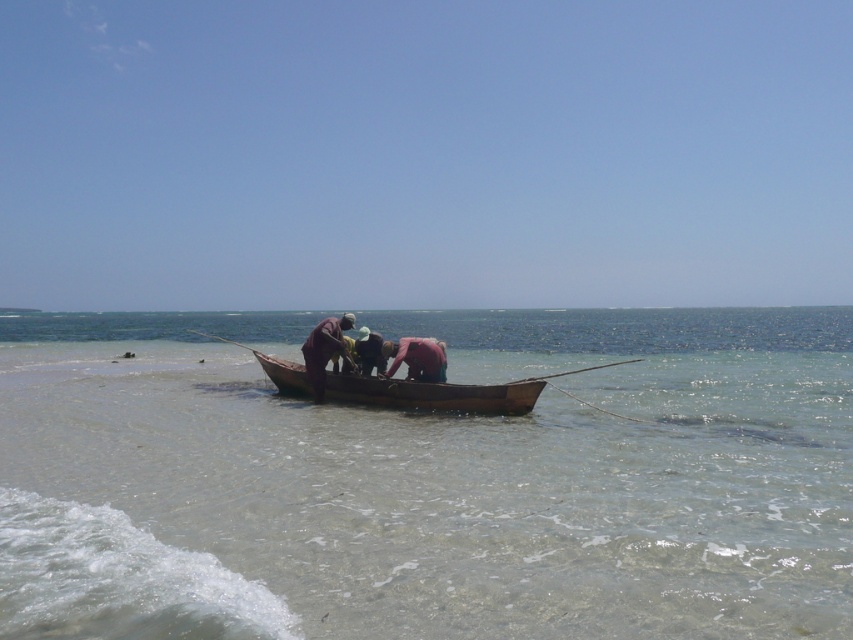
Can you confirm if dark brown wooden boat at center is positioned below brown fabric hat at center?

Yes.

You are a GUI agent. You are given a task and a screenshot of the screen. Output one action in this format:
    pyautogui.click(x=<x>, y=<y>)
    Task: Click on the dark brown wooden boat at center
    The image size is (853, 640).
    Given the screenshot: What is the action you would take?
    pyautogui.click(x=325, y=349)

Which is behind, point (349, 324) or point (380, 355)?

The point (349, 324) is more distant.

The height and width of the screenshot is (640, 853). Identify the location of dark brown wooden boat at center. (325, 349).

Does clear water at boat center come behind brown wooden canoe at center?

No, clear water at boat center is in front of brown wooden canoe at center.

Where is `clear water at boat center`? The height and width of the screenshot is (640, 853). clear water at boat center is located at coordinates (428, 481).

The image size is (853, 640). I want to click on clear water at boat center, so click(428, 481).

Is point (328, 401) closer to camera compared to point (364, 349)?

No.

This screenshot has height=640, width=853. Find the location of `brown wooden canoe at center`. brown wooden canoe at center is located at coordinates (434, 394).